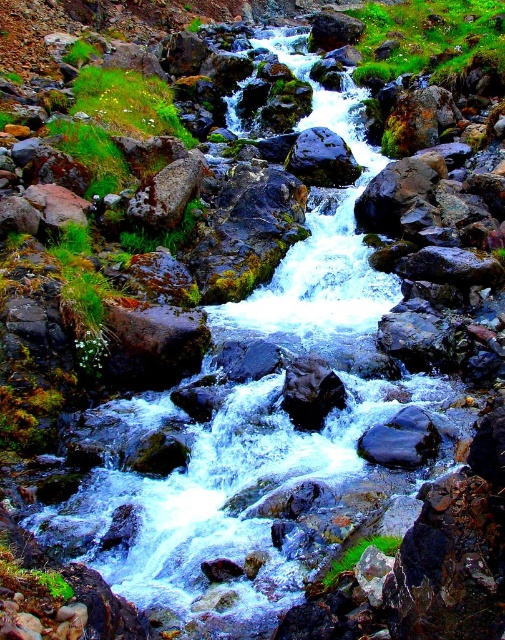
Question: Which point is farther to the camera?

Choices:
 (A) click(158, 180)
 (B) click(284, 166)

Answer: (B)

Question: Does green mossy rock at center-left appear on the left side of shiny dark rock at center?

Choices:
 (A) yes
 (B) no

Answer: (A)

Question: Is green mossy rock at center-left above shiny dark rock at center?

Choices:
 (A) no
 (B) yes

Answer: (A)

Question: Which point appears closest to the camera in this image?

Choices:
 (A) (318, 125)
 (B) (136, 211)

Answer: (B)

Question: Which object is closer to the camera taking this photo?

Choices:
 (A) shiny dark rock at center
 (B) green mossy rock at center-left

Answer: (B)

Question: Is green mossy rock at center-left smaller than shiny dark rock at center?

Choices:
 (A) no
 (B) yes

Answer: (B)